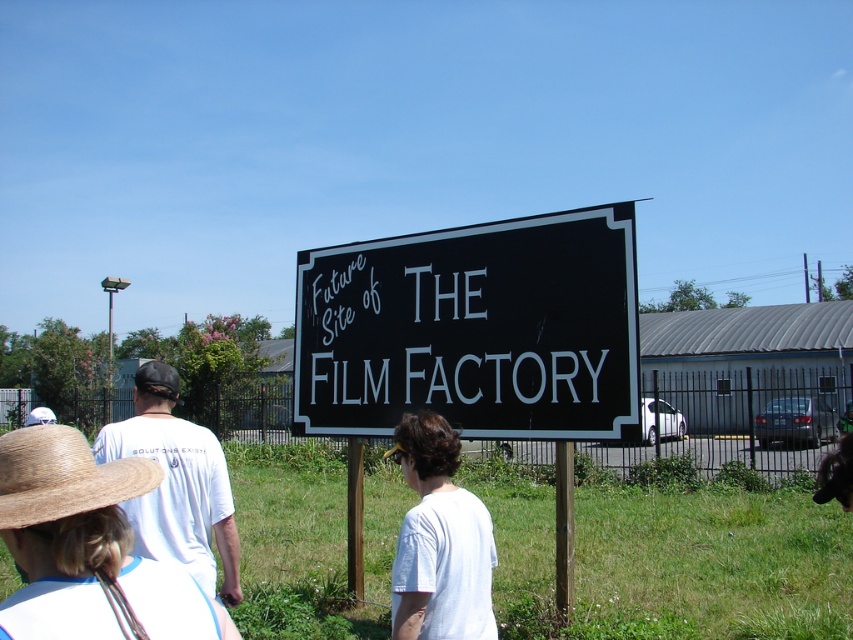
Question: Can you confirm if black painted signboard at center is smaller than white cotton shirt at left?

Choices:
 (A) no
 (B) yes

Answer: (A)

Question: Which of the following is the farthest from the observer?

Choices:
 (A) white cotton shirt at left
 (B) white cotton t-shirt at center-left

Answer: (B)

Question: Is black painted signboard at center to the right of white cotton shirt at left from the viewer's perspective?

Choices:
 (A) yes
 (B) no

Answer: (A)

Question: Based on their relative distances, which object is farther from the black painted signboard at center?

Choices:
 (A) brown straw hat at lower left
 (B) white cotton t-shirt at center-left
 (C) white cotton shirt at center

Answer: (A)

Question: Estimate the real-world distances between objects in this image. Which object is closer to the brown straw hat at lower left?

Choices:
 (A) white cotton shirt at left
 (B) white cotton shirt at center

Answer: (A)

Question: Is black painted signboard at center to the right of white cotton shirt at left from the viewer's perspective?

Choices:
 (A) no
 (B) yes

Answer: (B)